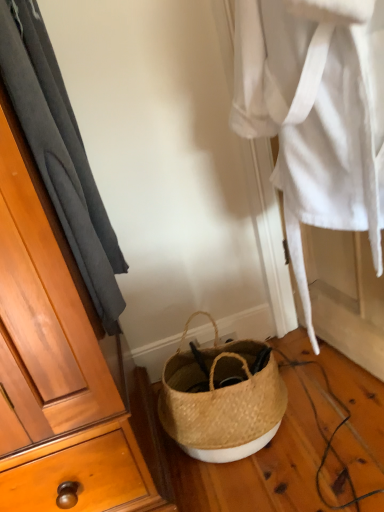
Question: From the image's perspective, is white woven robe at center above natural woven basket at lower center?

Choices:
 (A) no
 (B) yes

Answer: (B)

Question: Would you say white woven robe at center is a long distance from natural woven basket at lower center?

Choices:
 (A) yes
 (B) no

Answer: (B)

Question: Considering the relative sizes of white woven robe at center and natural woven basket at lower center in the image provided, is white woven robe at center taller than natural woven basket at lower center?

Choices:
 (A) yes
 (B) no

Answer: (A)

Question: From a real-world perspective, is white woven robe at center positioned under natural woven basket at lower center based on gravity?

Choices:
 (A) yes
 (B) no

Answer: (B)

Question: Does white woven robe at center touch natural woven basket at lower center?

Choices:
 (A) yes
 (B) no

Answer: (B)

Question: In the image, is dark gray fabric at left positioned in front of or behind white woven robe at center?

Choices:
 (A) behind
 (B) front

Answer: (B)

Question: Considering the positions of dark gray fabric at left and white woven robe at center in the image, is dark gray fabric at left taller or shorter than white woven robe at center?

Choices:
 (A) tall
 (B) short

Answer: (B)

Question: Visually, is dark gray fabric at left positioned to the left or to the right of white woven robe at center?

Choices:
 (A) left
 (B) right

Answer: (A)

Question: In terms of size, does dark gray fabric at left appear bigger or smaller than white woven robe at center?

Choices:
 (A) small
 (B) big

Answer: (A)

Question: Considering the positions of natural woven basket at lower center and white woven robe at center in the image, is natural woven basket at lower center bigger or smaller than white woven robe at center?

Choices:
 (A) small
 (B) big

Answer: (A)

Question: Considering their positions, is natural woven basket at lower center located in front of or behind white woven robe at center?

Choices:
 (A) front
 (B) behind

Answer: (B)

Question: Is natural woven basket at lower center to the left or to the right of white woven robe at center in the image?

Choices:
 (A) right
 (B) left

Answer: (B)

Question: Is point (210, 370) closer or farther from the camera than point (283, 30)?

Choices:
 (A) closer
 (B) farther

Answer: (B)

Question: From the image's perspective, is white woven robe at center positioned above or below natural woven basket at lower center?

Choices:
 (A) above
 (B) below

Answer: (A)

Question: Is white woven robe at center in front of or behind natural woven basket at lower center in the image?

Choices:
 (A) behind
 (B) front

Answer: (B)